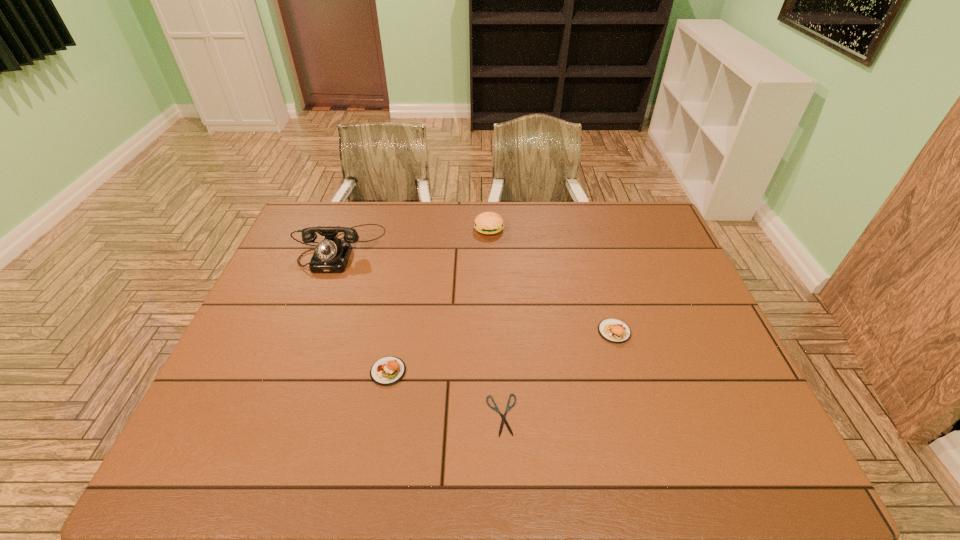
Image resolution: width=960 pixels, height=540 pixels. Identify the location of vacant position at the near edge of the desktop. (667, 470).

Identify the location of free region at the left edge of the desktop. (307, 249).

This screenshot has width=960, height=540. I want to click on blank space at the right edge of the desktop, so click(x=657, y=252).

The image size is (960, 540). What are the coordinates of `vacant area at the far right corner` in the screenshot? It's located at (609, 204).

The width and height of the screenshot is (960, 540). I want to click on vacant area that lies between the second object from left to right and the fourth shortest object, so click(439, 300).

Identify the location of unoccupied area between the second tallest object and the fourth tallest object. The image size is (960, 540). (439, 300).

Locate an element on the screen. The height and width of the screenshot is (540, 960). free spot between the nearest object and the fourth shortest object is located at coordinates (495, 322).

Find the location of a particular element. The height and width of the screenshot is (540, 960). vacant area between the third nearest object and the tallest patty (food) is located at coordinates (552, 280).

Where is `free space between the nearest object and the leftmost object`? free space between the nearest object and the leftmost object is located at coordinates (420, 332).

Locate an element on the screen. This screenshot has height=540, width=960. vacant region between the rightmost object and the nearest object is located at coordinates (558, 373).